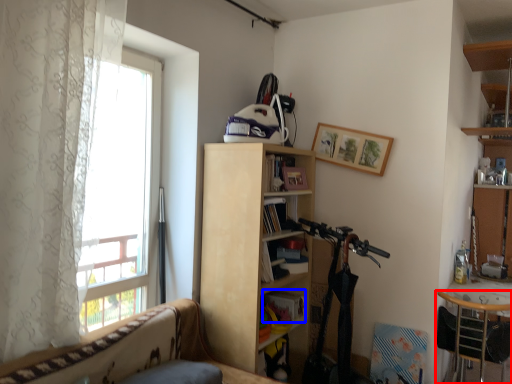
Question: Which point is closer to the camera, chair (highlighted by a red box) or book (highlighted by a blue box)?

Choices:
 (A) chair
 (B) book

Answer: (A)